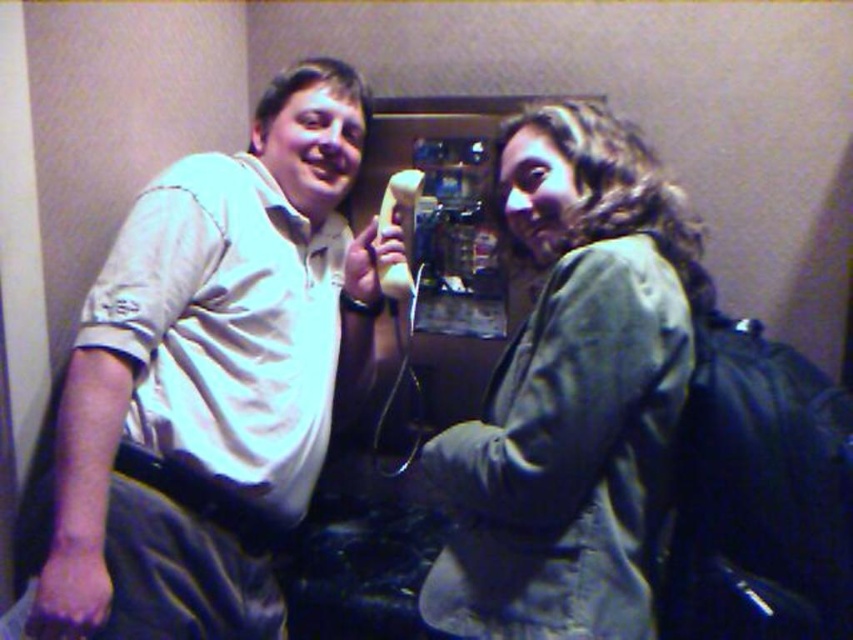
Question: Does matte white shirt at upper left appear under green fabric jacket at upper right?

Choices:
 (A) no
 (B) yes

Answer: (B)

Question: Which point is farther to the camera?

Choices:
 (A) (190, 225)
 (B) (503, 374)

Answer: (A)

Question: Is matte white shirt at upper left closer to camera compared to green fabric jacket at upper right?

Choices:
 (A) no
 (B) yes

Answer: (A)

Question: Can you confirm if matte white shirt at upper left is thinner than green fabric jacket at upper right?

Choices:
 (A) no
 (B) yes

Answer: (A)

Question: Which point is closer to the camera?

Choices:
 (A) (331, 113)
 (B) (462, 582)

Answer: (B)